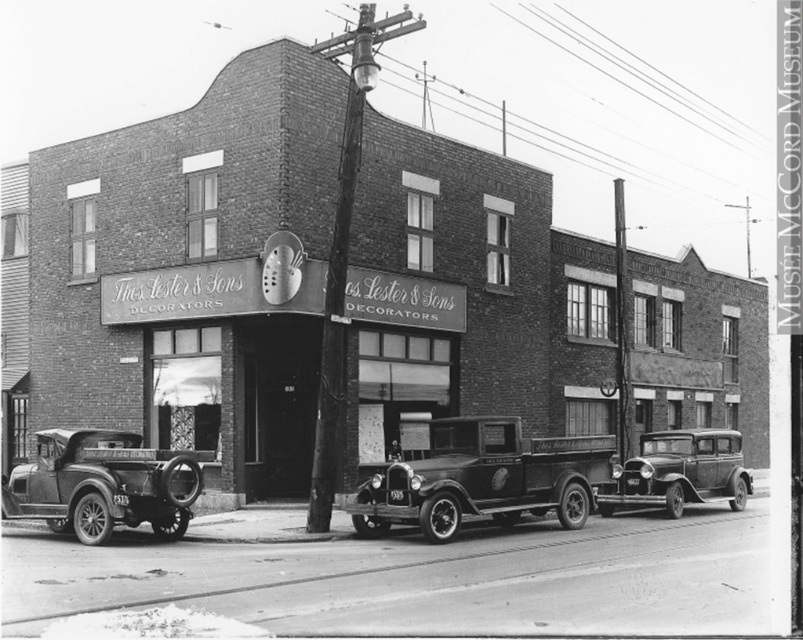
Question: Estimate the real-world distances between objects in this image. Which object is closer to the shiny black sedan at center?

Choices:
 (A) polished chrome car at left
 (B) polished wood pickup truck at center
 (C) smooth metal sign at center

Answer: (B)

Question: Can you confirm if polished wood pickup truck at center is smaller than polished chrome car at left?

Choices:
 (A) no
 (B) yes

Answer: (A)

Question: Considering the real-world distances, which object is farthest from the smooth metal sign at center?

Choices:
 (A) shiny black sedan at center
 (B) polished chrome car at left

Answer: (A)

Question: Observing the image, what is the correct spatial positioning of smooth metal sign at center in reference to shiny black sedan at center?

Choices:
 (A) below
 (B) above

Answer: (B)

Question: Is polished chrome car at left above shiny black sedan at center?

Choices:
 (A) yes
 (B) no

Answer: (A)

Question: Considering the real-world distances, which object is farthest from the shiny black sedan at center?

Choices:
 (A) polished chrome car at left
 (B) smooth metal sign at center

Answer: (A)